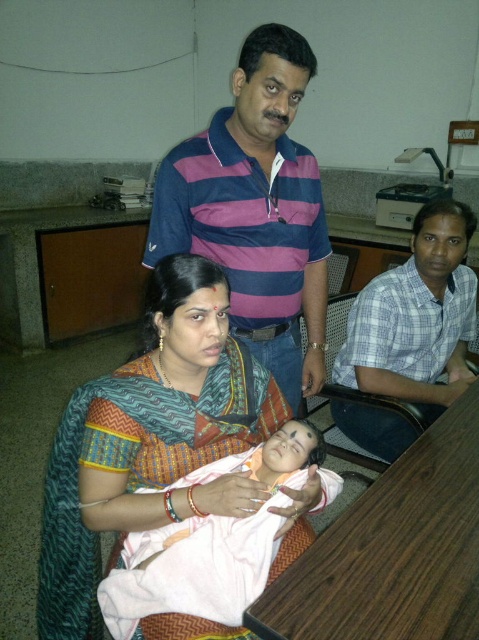
Is point (193, 499) in front of point (467, 410)?

Yes, it is.

At what (x,y) coordinates should I click in order to perform the action: click on multicolored saree at center. Please return your answer as a coordinate pair (x, y). The width and height of the screenshot is (479, 640). Looking at the image, I should click on (186, 397).

Is point (227, 326) closer to viewer compared to point (385, 275)?

Yes, it is in front of point (385, 275).

Is multicolored saree at center bigger than checkered fabric shirt at right?

Incorrect, multicolored saree at center is not larger than checkered fabric shirt at right.

The image size is (479, 640). What are the coordinates of `multicolored saree at center` in the screenshot? It's located at 186,397.

Does checkered fabric shirt at right come in front of pink fabric baby at center?

No, it is not.

Is point (408, 268) closer to camera compared to point (260, 534)?

No, it is not.

Who is more forward, [407,289] or [296,460]?

Point [296,460] is more forward.

In order to click on checkered fabric shirt at right in this screenshot , I will do `click(417, 317)`.